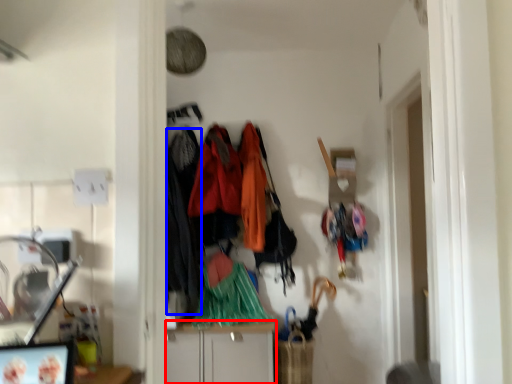
Question: Which object is closer to the camera taking this photo, cabinetry (highlighted by a red box) or clothing (highlighted by a blue box)?

Choices:
 (A) cabinetry
 (B) clothing

Answer: (A)